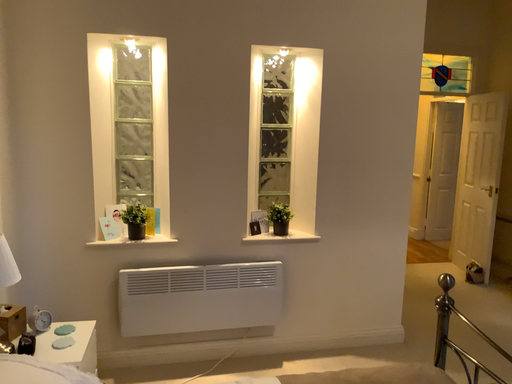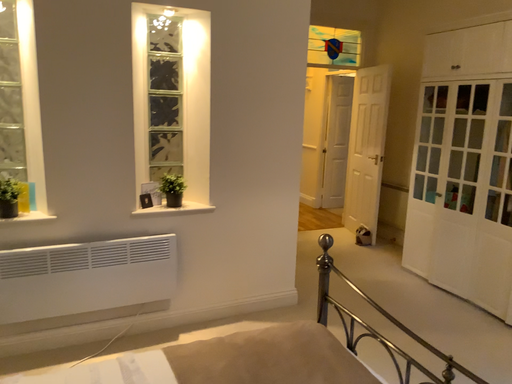
Question: How did the camera likely rotate when shooting the video?

Choices:
 (A) rotated right
 (B) rotated left

Answer: (A)